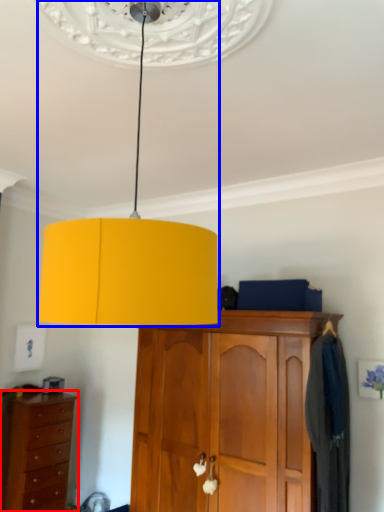
Question: Which object is closer to the camera taking this photo, chest of drawers (highlighted by a red box) or lamp (highlighted by a blue box)?

Choices:
 (A) chest of drawers
 (B) lamp

Answer: (B)